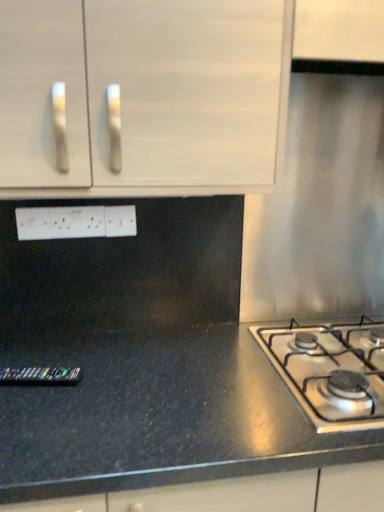
This screenshot has width=384, height=512. Identify the location of free point below white matte cabinet at upper left (from a real-world perspective). (142, 364).